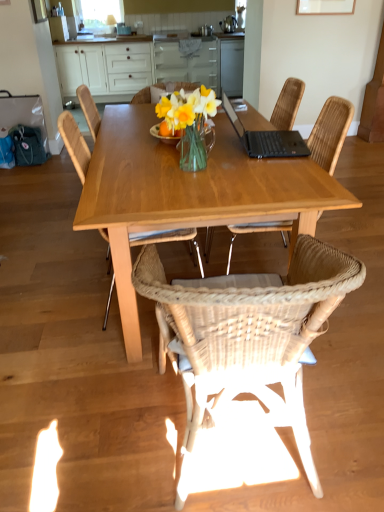
The image size is (384, 512). What do you see at coordinates (330, 132) in the screenshot? I see `woven rattan chair at center, the third chair viewed from the left` at bounding box center [330, 132].

You are a GUI agent. You are given a task and a screenshot of the screen. Output one action in this format:
    pyautogui.click(x=<x>, y=<y>)
    Task: Click on the white wood cabinets at upper center
    
    Given the screenshot: What is the action you would take?
    pyautogui.click(x=139, y=67)

From the picture: What is the approximate width of wooden table at center?

wooden table at center is 37.64 inches wide.

What do you see at coordinates (102, 15) in the screenshot? I see `transparent glass window screen at upper center` at bounding box center [102, 15].

This screenshot has width=384, height=512. Find the location of `woven wood chair at center, which is the 3th chair from right to left`. woven wood chair at center, which is the 3th chair from right to left is located at coordinates (74, 144).

Locate an element on the screen. woven rattan chair at center, the third chair viewed from the left is located at coordinates (330, 132).

Which object is positioned more to the left, woven rattan chair at center, the first chair in the right-to-left sequence, or woven wood chair at center, positioned as the first chair in left-to-right order?

woven wood chair at center, positioned as the first chair in left-to-right order.

Is woven rattan chair at center, the first chair in the right-to-left sequence, closer to camera compared to woven wood chair at center, which is the 3th chair from right to left?

No, the depth of woven rattan chair at center, the first chair in the right-to-left sequence, is greater than that of woven wood chair at center, which is the 3th chair from right to left.

Consider the image. Is woven rattan chair at center, the first chair in the right-to-left sequence, situated inside woven wood chair at center, positioned as the first chair in left-to-right order, or outside?

woven rattan chair at center, the first chair in the right-to-left sequence, is outside woven wood chair at center, positioned as the first chair in left-to-right order.

Where is `cabinetry behind the woven wood chair at center, which is the 3th chair from right to left`? This screenshot has height=512, width=384. cabinetry behind the woven wood chair at center, which is the 3th chair from right to left is located at coordinates (139, 67).

Is white wood cabinets at upper center not close to woven wood chair at center, positioned as the first chair in left-to-right order?

Yes.

Between white wood cabinets at upper center and woven wood chair at center, positioned as the first chair in left-to-right order, which one appears on the left side from the viewer's perspective?

white wood cabinets at upper center.

From the image's perspective, which one is positioned lower, black matte laptop at upper right or transparent glass window screen at upper center?

black matte laptop at upper right is shown below in the image.

Looking at the image, does black matte laptop at upper right seem bigger or smaller compared to transparent glass window screen at upper center?

Considering their sizes, black matte laptop at upper right takes up less space than transparent glass window screen at upper center.

From a real-world perspective, which object stands above the other?

In real-world perspective, transparent glass window screen at upper center is above.

Does point (302, 152) appear closer or farther from the camera than point (86, 20)?

Point (302, 152) is closer to the camera than point (86, 20).

Would you say black matte laptop at upper right contains woven wood chair at center, positioned as the first chair in left-to-right order?

Definitely not — woven wood chair at center, positioned as the first chair in left-to-right order, is not inside black matte laptop at upper right.

Considering the positions of objects black matte laptop at upper right and woven wood chair at center, positioned as the first chair in left-to-right order, in the image provided, who is more to the right, black matte laptop at upper right or woven wood chair at center, positioned as the first chair in left-to-right order,?

Positioned to the right is black matte laptop at upper right.

Where is `laptop on the right of woven wood chair at center, positioned as the first chair in left-to-right order`? This screenshot has width=384, height=512. laptop on the right of woven wood chair at center, positioned as the first chair in left-to-right order is located at coordinates (263, 134).

Which object is further away from the camera, black matte laptop at upper right or woven wood chair at center, which is the 3th chair from right to left?

black matte laptop at upper right is more distant.

Find the location of `kitchen & dining room table behind the woven rattan chair at center, arranged as the 2th chair when viewed from the left`. kitchen & dining room table behind the woven rattan chair at center, arranged as the 2th chair when viewed from the left is located at coordinates (189, 194).

Is woven rattan chair at center, arranged as the 2th chair when viewed from the left, looking in the opposite direction of wooden table at center?

That's not correct — woven rattan chair at center, arranged as the 2th chair when viewed from the left, is not looking away from wooden table at center.

Does point (142, 271) lie in front of point (216, 194)?

That is True.

Does woven rattan chair at center, arranged as the 2th chair when viewed from the left, contain wooden table at center?

No, wooden table at center is not surrounded by woven rattan chair at center, arranged as the 2th chair when viewed from the left.

In terms of size, does woven rattan chair at center, which is counted as the 2th chair, starting from the right, appear bigger or smaller than woven rattan chair at center, the third chair viewed from the left?

Clearly, woven rattan chair at center, which is counted as the 2th chair, starting from the right, is larger in size than woven rattan chair at center, the third chair viewed from the left.

Is point (194, 434) behind point (335, 147)?

No.

Locate an element on the screen. This screenshot has width=384, height=512. the 2nd chair in front of the woven rattan chair at center, the third chair viewed from the left is located at coordinates (248, 332).

Is point (119, 186) closer to viewer compared to point (90, 69)?

Yes.

From the image's perspective, is wooden table at center located above or below white wood cabinets at upper center?

From the image's perspective, wooden table at center appears below white wood cabinets at upper center.

Relative to white wood cabinets at upper center, is wooden table at center in front or behind?

In the image, wooden table at center appears in front of white wood cabinets at upper center.

The image size is (384, 512). Identify the location of kitchen & dining room table below the white wood cabinets at upper center (from the image's perspective). (189, 194).

Locate an element on the screen. The image size is (384, 512). the 1st chair in front of the woven rattan chair at center, the third chair viewed from the left is located at coordinates (74, 144).

Locate an element on the screen. The height and width of the screenshot is (512, 384). cabinetry located behind the woven wood chair at center, positioned as the first chair in left-to-right order is located at coordinates (139, 67).

Which object lies further to the anchor point white wood cabinets at upper center, woven rattan chair at center, the first chair in the right-to-left sequence, or wooden table at center?

The object further to white wood cabinets at upper center is woven rattan chair at center, the first chair in the right-to-left sequence.

Looking at the image, which one is located further to white wood cabinets at upper center, woven wood chair at center, which is the 3th chair from right to left, or woven rattan chair at center, arranged as the 2th chair when viewed from the left?

The object further to white wood cabinets at upper center is woven rattan chair at center, arranged as the 2th chair when viewed from the left.

Estimate the real-world distances between objects in this image. Which object is further from white wood cabinets at upper center, wooden table at center or black matte laptop at upper right?

Among the two, wooden table at center is located further to white wood cabinets at upper center.

From the image, which object appears to be nearer to transparent glass window screen at upper center, black matte laptop at upper right or woven rattan chair at center, which is counted as the 2th chair, starting from the right?

black matte laptop at upper right.

Which object lies further to the anchor point transparent glass window screen at upper center, woven wood chair at center, positioned as the first chair in left-to-right order, or wooden table at center?

The object further to transparent glass window screen at upper center is woven wood chair at center, positioned as the first chair in left-to-right order.

Estimate the real-world distances between objects in this image. Which object is closer to white wood cabinets at upper center, black matte laptop at upper right or woven rattan chair at center, which is counted as the 2th chair, starting from the right?

Among the two, black matte laptop at upper right is located nearer to white wood cabinets at upper center.

Looking at the image, which one is located further to woven rattan chair at center, the third chair viewed from the left, wooden table at center or black matte laptop at upper right?

wooden table at center is positioned further to the anchor woven rattan chair at center, the third chair viewed from the left.

Estimate the real-world distances between objects in this image. Which object is further from white wood cabinets at upper center, woven rattan chair at center, the first chair in the right-to-left sequence, or woven wood chair at center, positioned as the first chair in left-to-right order?

woven wood chair at center, positioned as the first chair in left-to-right order, is further to white wood cabinets at upper center.

Image resolution: width=384 pixels, height=512 pixels. I want to click on kitchen & dining room table located between woven wood chair at center, positioned as the first chair in left-to-right order, and woven rattan chair at center, the first chair in the right-to-left sequence, in the left-right direction, so click(x=189, y=194).

The width and height of the screenshot is (384, 512). I want to click on laptop positioned between wooden table at center and white wood cabinets at upper center from near to far, so click(x=263, y=134).

Where is `kitchen & dining room table that lies between black matte laptop at upper right and woven rattan chair at center, arranged as the 2th chair when viewed from the left, from top to bottom`? This screenshot has width=384, height=512. kitchen & dining room table that lies between black matte laptop at upper right and woven rattan chair at center, arranged as the 2th chair when viewed from the left, from top to bottom is located at coordinates (189, 194).

The image size is (384, 512). I want to click on cabinetry between wooden table at center and transparent glass window screen at upper center in the front-back direction, so click(x=139, y=67).